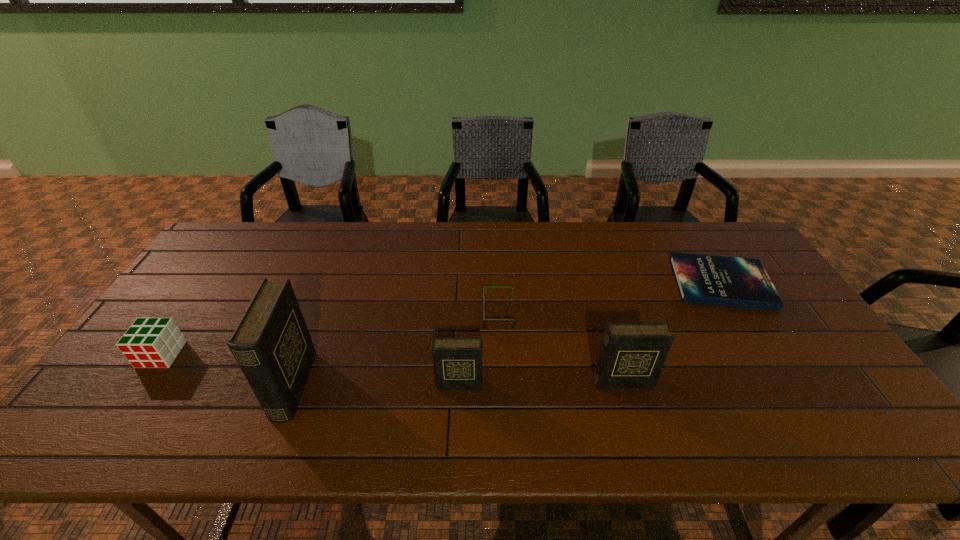
Identify the location of the leftmost diary. (272, 345).

This screenshot has width=960, height=540. In order to click on the tallest object in this screenshot , I will do `click(272, 345)`.

This screenshot has width=960, height=540. In order to click on the shortest diary in this screenshot , I will do `click(457, 362)`.

I want to click on the second diary from left to right, so click(x=457, y=362).

Locate an element on the screen. This screenshot has height=540, width=960. the second tallest object is located at coordinates (632, 355).

In order to click on the second shortest diary in this screenshot , I will do `click(632, 355)`.

Where is `the rightmost object`? This screenshot has height=540, width=960. the rightmost object is located at coordinates (727, 281).

Image resolution: width=960 pixels, height=540 pixels. Identify the location of hardback book. (727, 281).

You are a GUI agent. You are given a task and a screenshot of the screen. Output one action in this format:
    pyautogui.click(x=<x>, y=<y>)
    Task: Click on the cube
    
    Given the screenshot: What is the action you would take?
    pyautogui.click(x=150, y=342)

The width and height of the screenshot is (960, 540). Identify the location of the third shortest object. (150, 342).